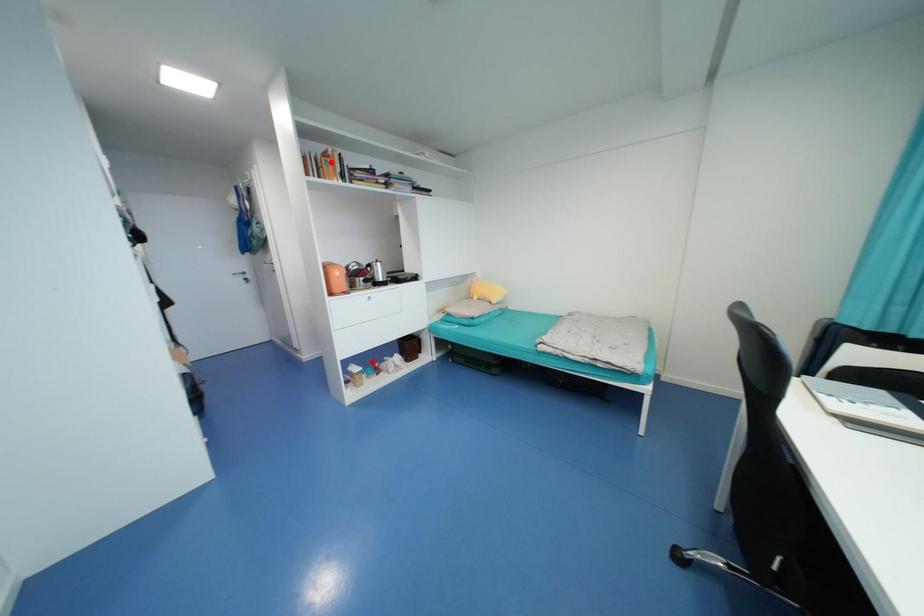
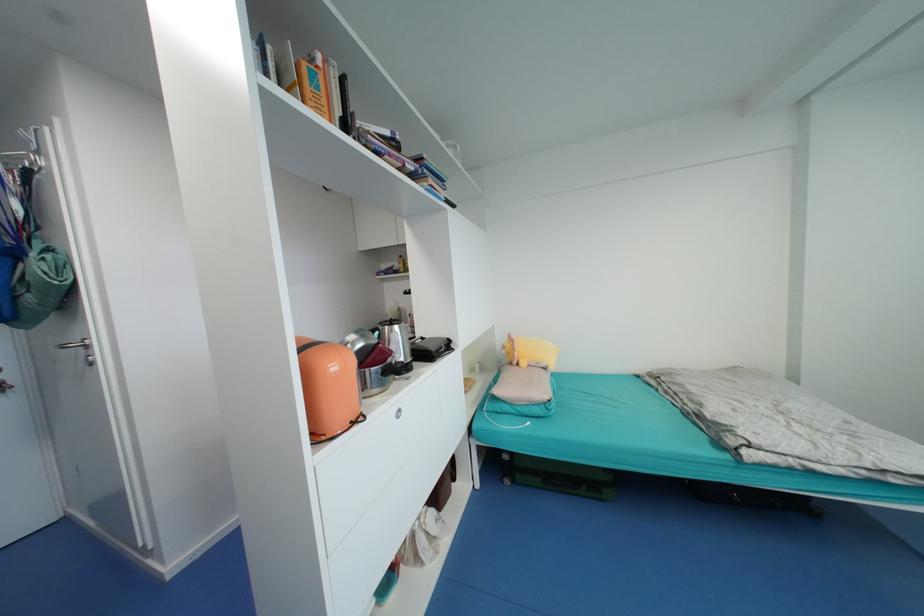
Locate, in the second image, the point that corresponds to the highlighted location in the first image.

(317, 76)